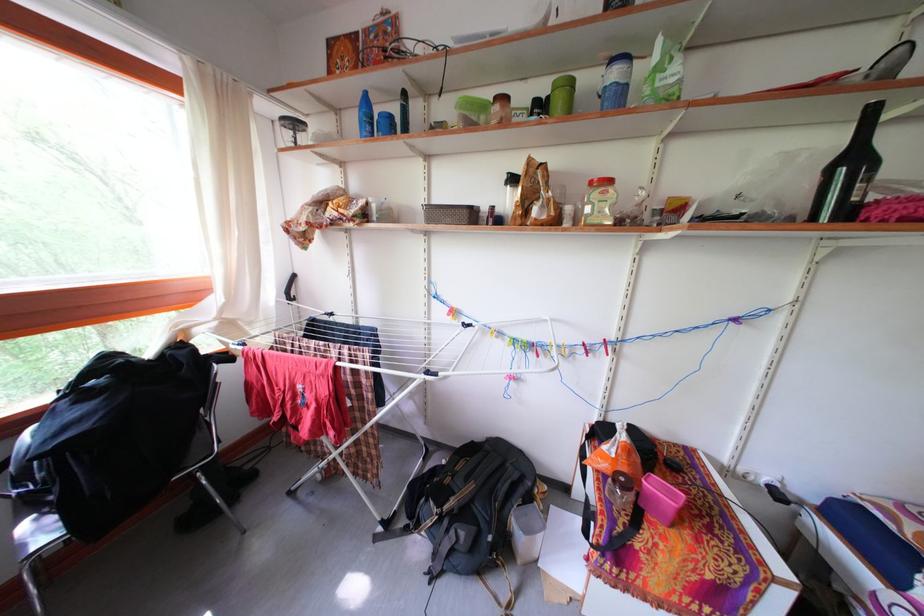
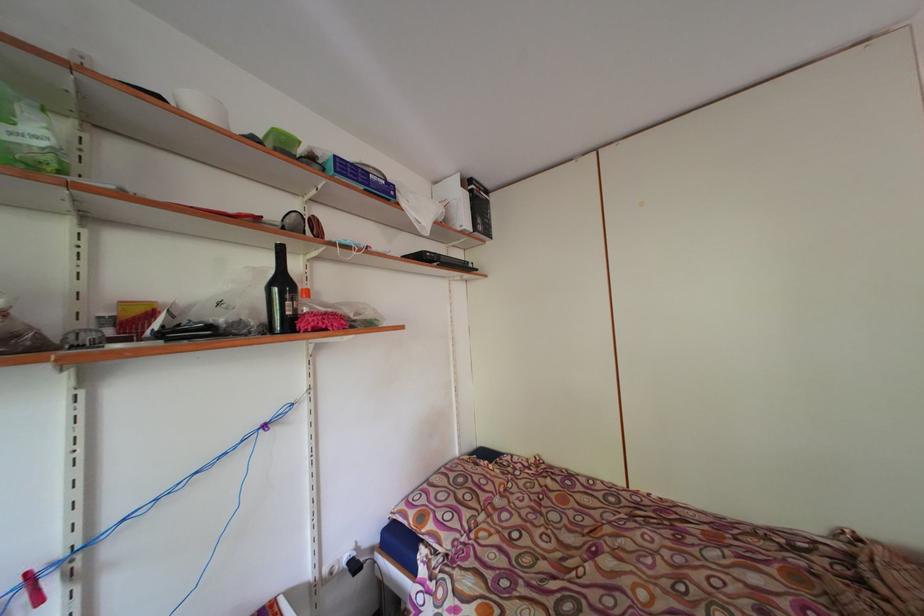
Question: Based on the continuous images, in which direction is the camera rotating? Reply with the corresponding letter.

Choices:
 (A) Left
 (B) Right
 (C) Up
 (D) Down

Answer: (B)